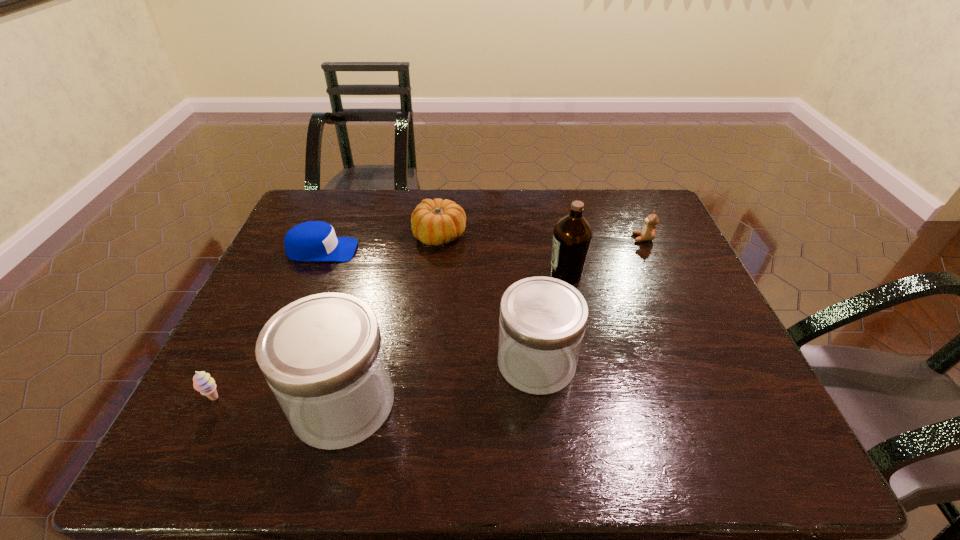
This screenshot has height=540, width=960. Identify the location of vacant space positioned on the left of the gourd. (314, 235).

The image size is (960, 540). Identify the location of vacant region located 0.090m on the front-facing side of the rightmost object. (604, 238).

Identify the location of vacant space located 0.050m on the front-facing side of the rightmost object. The image size is (960, 540). (616, 238).

At what (x,y) coordinates should I click in order to perform the action: click on free space located on the front-facing side of the rightmost object. Please return your answer as a coordinate pair (x, y). The width and height of the screenshot is (960, 540). Looking at the image, I should click on (597, 238).

Locate an element on the screen. This screenshot has height=540, width=960. vacant point located 0.120m on the front-facing side of the baseball cap is located at coordinates click(397, 251).

This screenshot has width=960, height=540. What are the coordinates of `free space located 0.110m on the label of the olive oil` in the screenshot? It's located at (509, 274).

Find the location of `vacant area situated 0.070m on the label of the olive oil`. vacant area situated 0.070m on the label of the olive oil is located at coordinates (523, 274).

The width and height of the screenshot is (960, 540). What are the coordinates of `vacant region located 0.280m on the label of the olive oil` in the screenshot? It's located at (447, 274).

Find the location of a particular element. The image size is (960, 540). free space located on the back of the sherbert is located at coordinates (274, 280).

What are the coordinates of `gourd located at the far edge` in the screenshot? It's located at (436, 222).